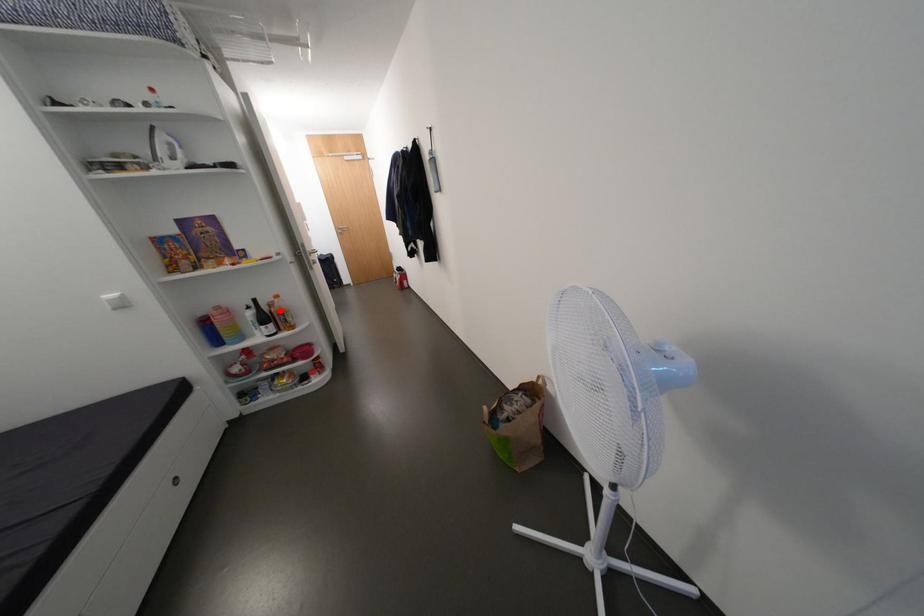
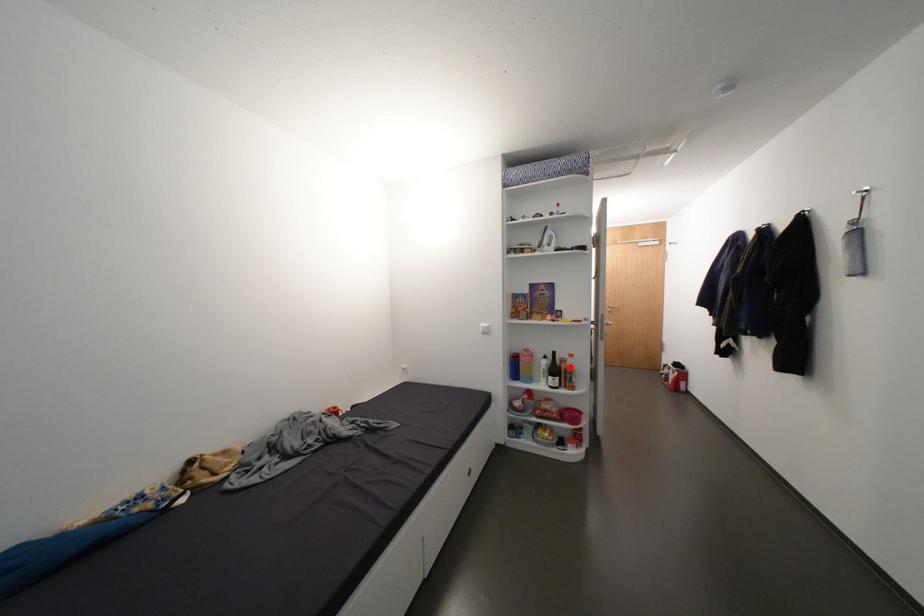
I am providing you with two images of the same scene from different viewpoints. A red point is marked on the first image and another point is marked on the second image. Do the highlighted points in image1 and image2 indicate the same real-world spot?

Yes